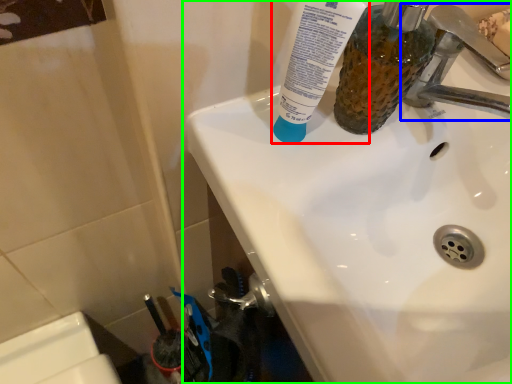
Question: Estimate the real-world distances between objects in this image. Which object is closer to toothpaste (highlighted by a red box), tap (highlighted by a blue box) or sink (highlighted by a green box)?

Choices:
 (A) tap
 (B) sink

Answer: (B)